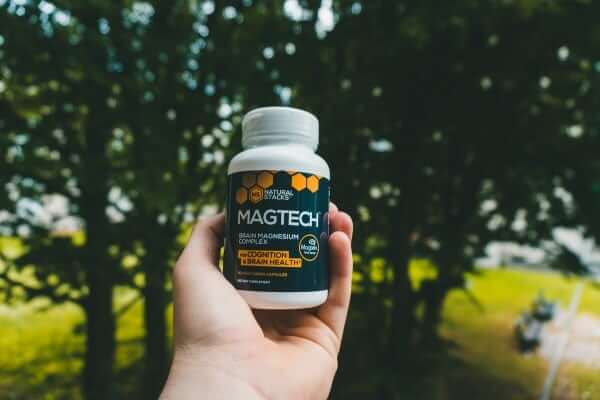
Find the location of a particular element. The width and height of the screenshot is (600, 400). pill bottle is located at coordinates (267, 161).